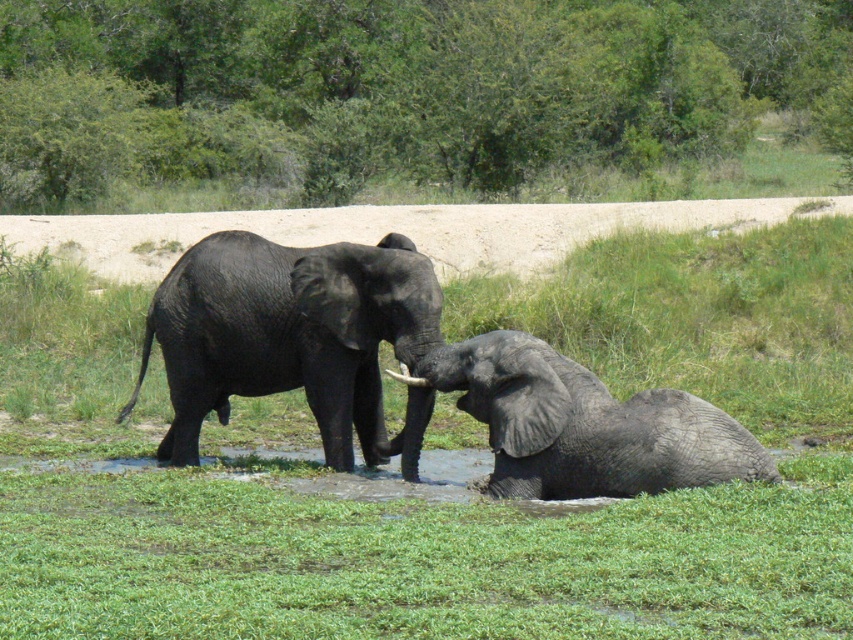
Question: Does green grassy at center appear on the right side of white ivory tusk at upper center?

Choices:
 (A) yes
 (B) no

Answer: (B)

Question: Is green grassy at center wider than white ivory tusk at upper center?

Choices:
 (A) yes
 (B) no

Answer: (A)

Question: Based on their relative distances, which object is farther from the shiny black elephant at center?

Choices:
 (A) white ivory tusk at upper center
 (B) green grassy at center

Answer: (B)

Question: Is shiny black elephant at center below gray matte elephant at lower right?

Choices:
 (A) yes
 (B) no

Answer: (B)

Question: Which point appears closest to the camera in this image?

Choices:
 (A) (316, 353)
 (B) (25, 512)

Answer: (B)

Question: Based on their relative distances, which object is nearer to the shiny black elephant at center?

Choices:
 (A) green grassy at center
 (B) gray matte elephant at lower right

Answer: (B)